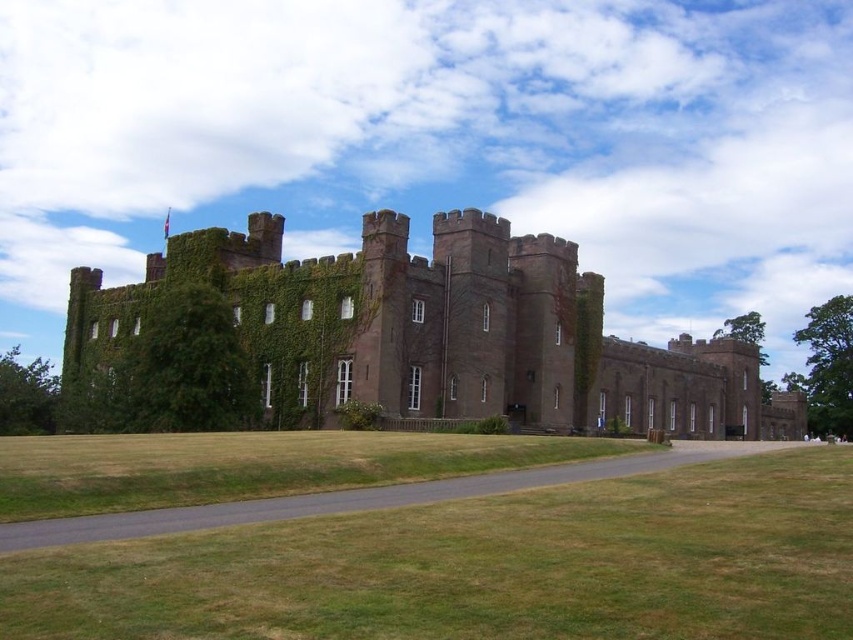
Which of these two, brown stone castle at center or green ivy at left, stands taller?

With more height is brown stone castle at center.

Who is positioned more to the right, brown stone castle at center or green ivy at left?

brown stone castle at center

Describe the element at coordinates (439, 332) in the screenshot. This screenshot has height=640, width=853. I see `brown stone castle at center` at that location.

Identify the location of brown stone castle at center. The height and width of the screenshot is (640, 853). (439, 332).